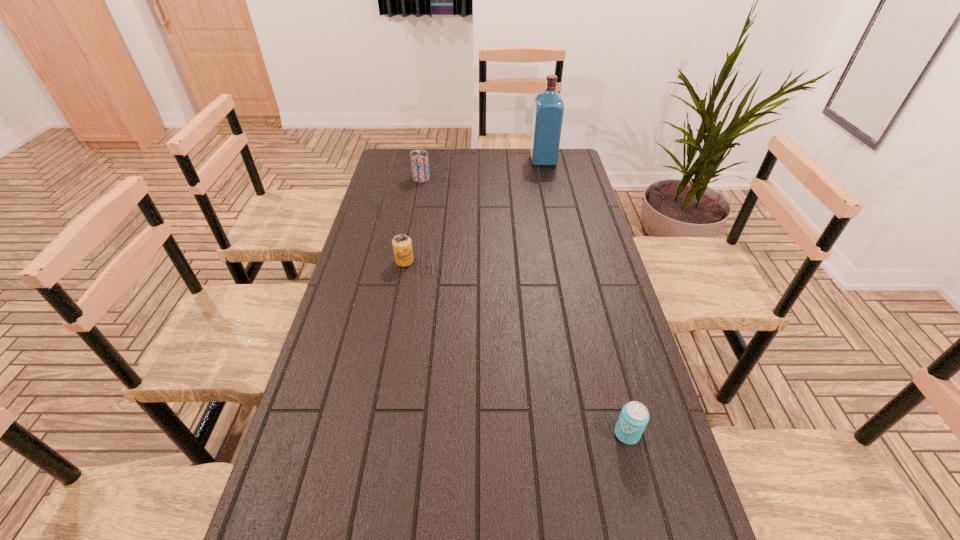
Where is `vacant space at the right edge of the desktop`? vacant space at the right edge of the desktop is located at coordinates (583, 249).

Locate an element on the screen. The height and width of the screenshot is (540, 960). empty space between the tallest object and the nearest beer can is located at coordinates click(585, 297).

At what (x,y) coordinates should I click in order to perform the action: click on free space between the nearest object and the third nearest object. Please return your answer as a coordinate pair (x, y). Image resolution: width=960 pixels, height=540 pixels. Looking at the image, I should click on (524, 306).

At what (x,y) coordinates should I click in order to perform the action: click on empty location between the second nearest object and the rightmost beer can. Please return your answer as a coordinate pair (x, y). The image size is (960, 540). Looking at the image, I should click on (516, 348).

The image size is (960, 540). Identify the location of free space between the second farthest object and the farthest object. (482, 170).

Locate which object is the third closest to the nearest beer can. Please provide its 2D coordinates. Your answer should be formatted as a tuple, i.e. [(x, y)], where the tuple contains the x and y coordinates of a point satisfying the conditions above.

[(548, 112)]

Where is `the closest object to the nearest beer can`? Image resolution: width=960 pixels, height=540 pixels. the closest object to the nearest beer can is located at coordinates pos(402,247).

Identify the location of beer can that is the closest one to the third farthest object. This screenshot has width=960, height=540. (419, 158).

Identify which beer can is located as the third nearest to the tallest object. Please provide its 2D coordinates. Your answer should be formatted as a tuple, i.e. [(x, y)], where the tuple contains the x and y coordinates of a point satisfying the conditions above.

[(634, 416)]

Image resolution: width=960 pixels, height=540 pixels. I want to click on free point that satisfies the following two spatial constraints: 1. on the flat label side of the rightmost beer can; 2. on the left side of the tallest object, so click(x=602, y=434).